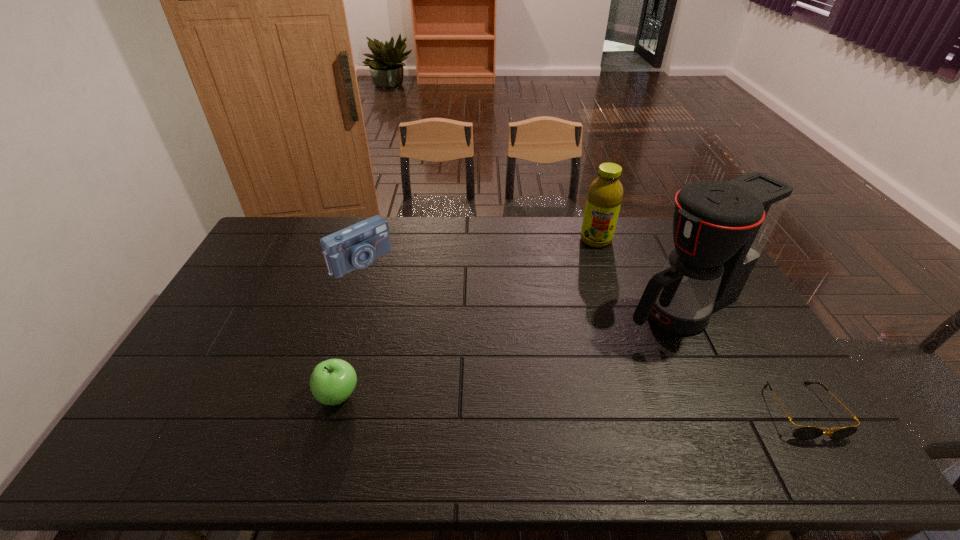
This screenshot has height=540, width=960. What are the coordinates of `vacant space on the desktop that is between the apple and the sunglasses and is positioned on the front label of the fruit juice` in the screenshot? It's located at (580, 403).

Where is `free space on the desktop that is between the fourth tallest object and the shortest object and is positioned on the lens of the camera`? The image size is (960, 540). free space on the desktop that is between the fourth tallest object and the shortest object and is positioned on the lens of the camera is located at coordinates (512, 401).

You are a GUI agent. You are given a task and a screenshot of the screen. Output one action in this format:
    pyautogui.click(x=<x>, y=<y>)
    Task: Click on the vacant spot on the desktop that is between the apple and the shortest object and is positioned pour from the carafe of the tallest object
    This screenshot has width=960, height=540.
    Given the screenshot: What is the action you would take?
    pyautogui.click(x=499, y=401)